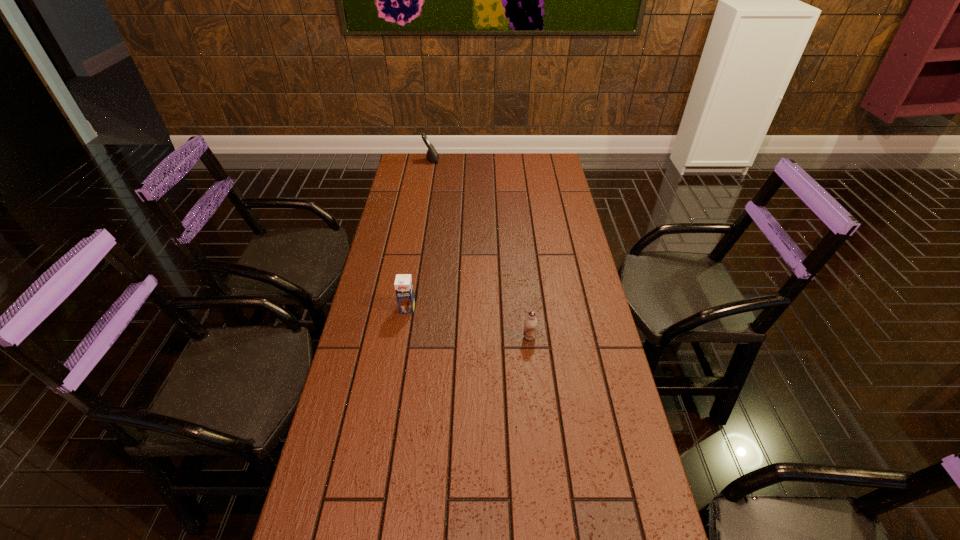
In order to click on free spot between the farthest object and the rightmost object in this screenshot , I will do `click(480, 249)`.

Identify the location of empty location between the cellular telephone and the nearer chocolate milk. The height and width of the screenshot is (540, 960). (480, 249).

At what (x,y) coordinates should I click in order to perform the action: click on vacant space in between the cellular telephone and the nearer chocolate milk. Please return your answer as a coordinate pair (x, y). Looking at the image, I should click on (480, 249).

Find the location of a particular element. The image size is (960, 540). vacant point located between the nearest object and the cellular telephone is located at coordinates (480, 249).

Where is `free space between the left chocolate milk and the cellular telephone`? free space between the left chocolate milk and the cellular telephone is located at coordinates (420, 234).

This screenshot has width=960, height=540. I want to click on vacant region between the cellular telephone and the shortest object, so click(480, 249).

Image resolution: width=960 pixels, height=540 pixels. I want to click on the second closest object to the cellular telephone, so click(530, 324).

Locate an element on the screen. The height and width of the screenshot is (540, 960). object that is the second closest to the shortest object is located at coordinates (432, 155).

This screenshot has width=960, height=540. Find the location of `free space that satisfies the following two spatial constraints: 1. on the front label of the shortest object; 2. on the right side of the second farthest object`. free space that satisfies the following two spatial constraints: 1. on the front label of the shortest object; 2. on the right side of the second farthest object is located at coordinates (403, 337).

At what (x,y) coordinates should I click in order to perform the action: click on vacant space that satisfies the following two spatial constraints: 1. on the front-facing side of the cellular telephone; 2. on the back side of the right chocolate milk. Please return your answer as a coordinate pair (x, y). Looking at the image, I should click on (402, 337).